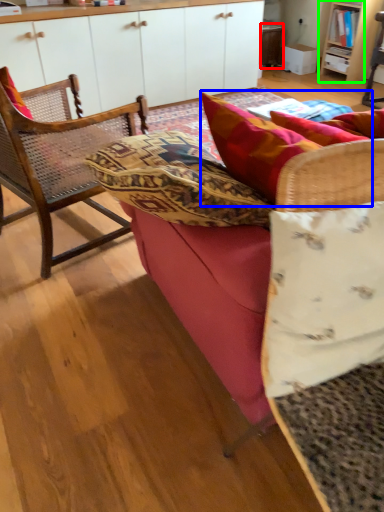
Question: Which object is the closest to the table (highlighted by a red box)? Choose among these: pillow (highlighted by a blue box) or shelf (highlighted by a green box).

Choices:
 (A) pillow
 (B) shelf

Answer: (B)